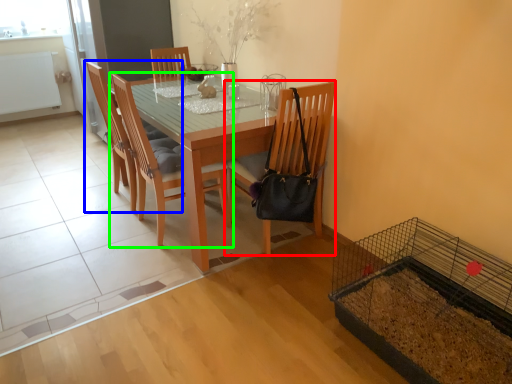
Question: Which object is the closest to the chair (highlighted by a red box)? Choose among these: chair (highlighted by a blue box) or chair (highlighted by a green box).

Choices:
 (A) chair
 (B) chair

Answer: (B)